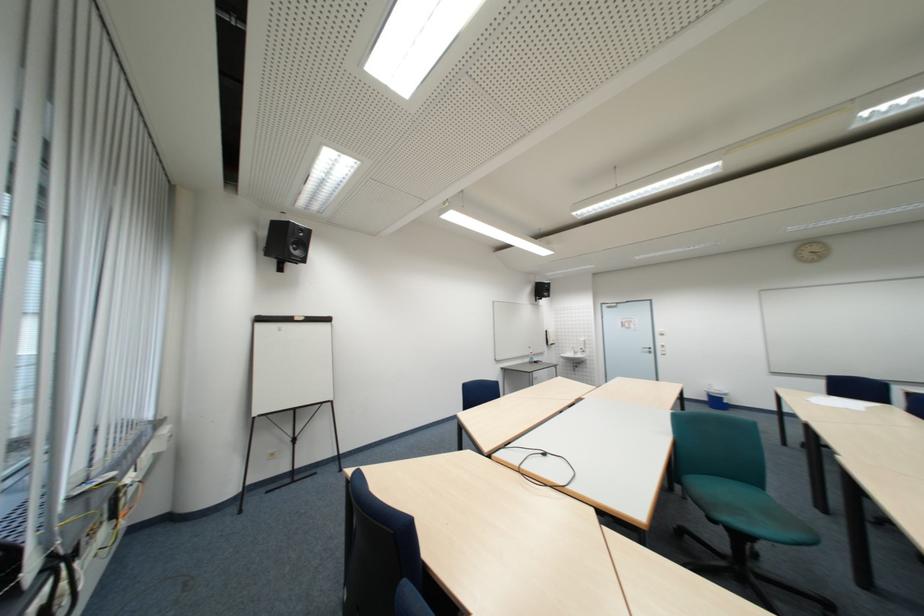
Locate an element on the screen. This screenshot has width=924, height=616. flip chart clamp is located at coordinates (289, 379).